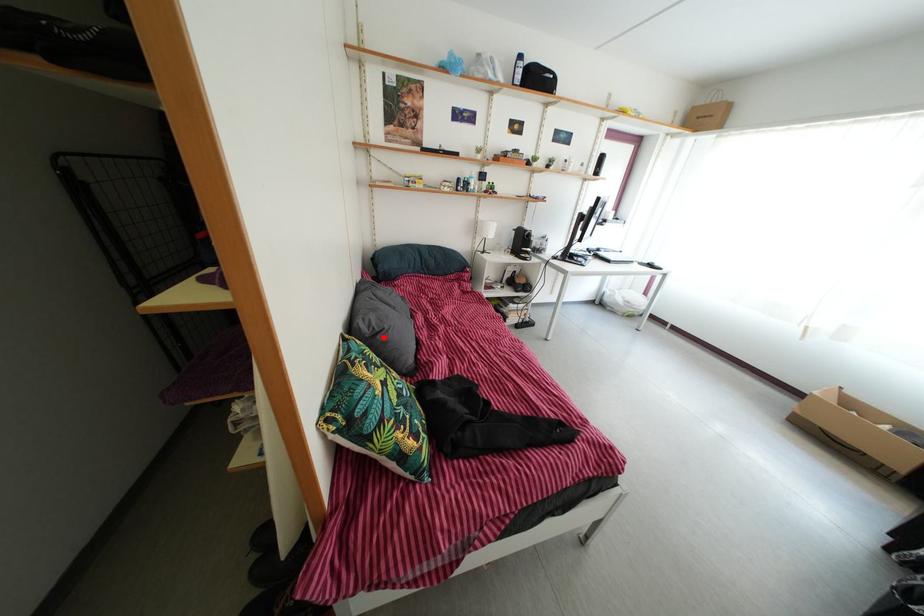
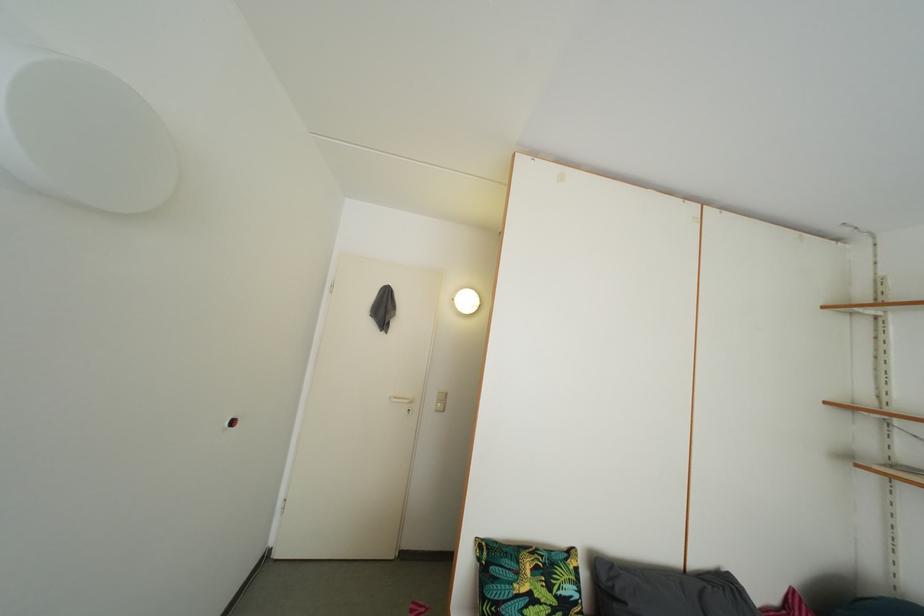
Question: I am providing you with two images of the same scene from different viewpoints. Given a red point in image1, look at the same physical point in image2. Is it:

Choices:
 (A) Closer to the viewpoint
 (B) Farther from the viewpoint

Answer: (B)